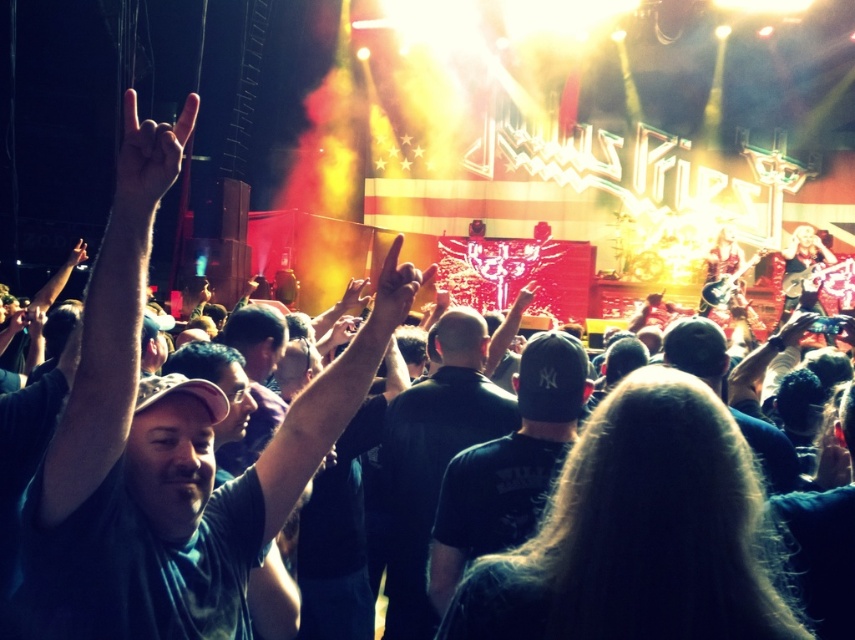
Question: Is dark green t-shirt at left smaller than matte black hand at upper left?

Choices:
 (A) yes
 (B) no

Answer: (A)

Question: Does dark green t-shirt at left appear on the right side of matte black hand at upper left?

Choices:
 (A) yes
 (B) no

Answer: (A)

Question: Which of the following is the farthest from the observer?

Choices:
 (A) matte black hand at upper left
 (B) dark green t-shirt at left

Answer: (A)

Question: Which of the following is the farthest from the observer?

Choices:
 (A) (154, 163)
 (B) (115, 570)

Answer: (A)

Question: Which of the following is the farthest from the observer?

Choices:
 (A) dark green t-shirt at left
 (B) matte black hand at upper left

Answer: (B)

Question: Considering the relative positions of dark green t-shirt at left and matte black hand at upper left in the image provided, where is dark green t-shirt at left located with respect to matte black hand at upper left?

Choices:
 (A) below
 (B) above

Answer: (A)